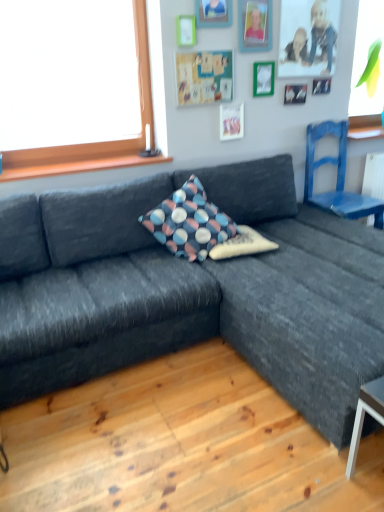
This screenshot has width=384, height=512. What do you see at coordinates (263, 78) in the screenshot? I see `green matte picture frame at upper center, arranged as the 2th picture frame when viewed from the right` at bounding box center [263, 78].

Find the location of a particular element. The image size is (384, 512). textured fabric pillow at center, which appears as the first pillow when ordered from the bottom is located at coordinates (242, 244).

This screenshot has height=512, width=384. What are the coordinates of `metallic silver picture frame at upper center, positioned as the third picture frame in right-to-left order` in the screenshot? It's located at (255, 25).

What is the approximate height of blue painted wood chair at right?

blue painted wood chair at right is 31.37 inches tall.

What do you see at coordinates (193, 292) in the screenshot?
I see `dark gray fabric couch at center` at bounding box center [193, 292].

You are a GUI agent. You are given a task and a screenshot of the screen. Output one action in this format:
    pyautogui.click(x=<x>, y=<y>)
    Task: Click on the wooden picture frame at upper center, which appears as the fifth picture frame when viewed from the right
    The image size is (384, 512).
    Given the screenshot: What is the action you would take?
    pyautogui.click(x=214, y=13)

Identify the location of polka dot fabric pillow at center, placed as the first pillow when sorted from top to bottom. The width and height of the screenshot is (384, 512). (189, 222).

Between wooden picture frame at upper center, which is the sixth picture frame from left to right, and white paper at upper center, which appears as the fourth picture frame when viewed from the right, which one has larger size?

white paper at upper center, which appears as the fourth picture frame when viewed from the right.

Based on the photo, from a real-world perspective, which is physically below, wooden picture frame at upper center, which is the sixth picture frame from left to right, or white paper at upper center, which appears as the fourth picture frame when viewed from the right?

Result: From a 3D spatial view, white paper at upper center, which appears as the fourth picture frame when viewed from the right, is below.

Does wooden picture frame at upper center, which is the sixth picture frame from left to right, have a greater width compared to white paper at upper center, which appears as the fourth picture frame when viewed from the right?

Incorrect, the width of wooden picture frame at upper center, which is the sixth picture frame from left to right, does not surpass that of white paper at upper center, which appears as the fourth picture frame when viewed from the right.

From the image's perspective, relative to white paper at upper center, which is the 3th picture frame from left to right, is wooden picture frame at upper center, positioned as the first picture frame in right-to-left order, above or below?

wooden picture frame at upper center, positioned as the first picture frame in right-to-left order, is situated higher than white paper at upper center, which is the 3th picture frame from left to right, in the image.

Is the surface of polka dot fabric pillow at center, which is counted as the second pillow, starting from the bottom, in direct contact with wooden picture frame at upper center, positioned as the first picture frame in right-to-left order?

No, polka dot fabric pillow at center, which is counted as the second pillow, starting from the bottom, is not beside wooden picture frame at upper center, positioned as the first picture frame in right-to-left order.

Identify the location of pillow that is the 1st object located below the wooden picture frame at upper center, which is the sixth picture frame from left to right (from the image's perspective). Image resolution: width=384 pixels, height=512 pixels. (189, 222).

Is wooden picture frame at upper center, which is the sixth picture frame from left to right, located within polka dot fabric pillow at center, placed as the first pillow when sorted from top to bottom?

No.

Does polka dot fabric pillow at center, placed as the first pillow when sorted from top to bottom, appear on the left side of wooden picture frame at upper center, which is the sixth picture frame from left to right?

Yes.

Is green matte picture frame at upper center, the fifth picture frame in the left-to-right sequence, looking in the opposite direction of metallic silver picture frame at upper center, marked as the fourth picture frame in a left-to-right arrangement?

No, green matte picture frame at upper center, the fifth picture frame in the left-to-right sequence, is not facing the opposite direction of metallic silver picture frame at upper center, marked as the fourth picture frame in a left-to-right arrangement.

Considering the relative positions of green matte picture frame at upper center, the fifth picture frame in the left-to-right sequence, and metallic silver picture frame at upper center, marked as the fourth picture frame in a left-to-right arrangement, in the image provided, is green matte picture frame at upper center, the fifth picture frame in the left-to-right sequence, to the left of metallic silver picture frame at upper center, marked as the fourth picture frame in a left-to-right arrangement, from the viewer's perspective?

In fact, green matte picture frame at upper center, the fifth picture frame in the left-to-right sequence, is to the right of metallic silver picture frame at upper center, marked as the fourth picture frame in a left-to-right arrangement.

Considering the positions of points (267, 82) and (269, 28), is point (267, 82) farther from camera compared to point (269, 28)?

Yes, point (267, 82) is behind point (269, 28).

Is green matte picture frame at upper center, the fifth picture frame in the left-to-right sequence, touching metallic silver picture frame at upper center, marked as the fourth picture frame in a left-to-right arrangement?

No, green matte picture frame at upper center, the fifth picture frame in the left-to-right sequence, is not next to metallic silver picture frame at upper center, marked as the fourth picture frame in a left-to-right arrangement.

From their relative heights in the image, would you say metallic silver picture frame at upper center, marked as the fourth picture frame in a left-to-right arrangement, is taller or shorter than matte green bulletin board at upper center?

Considering their sizes, metallic silver picture frame at upper center, marked as the fourth picture frame in a left-to-right arrangement, has more height than matte green bulletin board at upper center.

Find the location of `bulletin board on the left of metallic silver picture frame at upper center, marked as the fourth picture frame in a left-to-right arrangement`. bulletin board on the left of metallic silver picture frame at upper center, marked as the fourth picture frame in a left-to-right arrangement is located at coordinates (204, 77).

From the image's perspective, which one is positioned lower, metallic silver picture frame at upper center, marked as the fourth picture frame in a left-to-right arrangement, or matte green bulletin board at upper center?

matte green bulletin board at upper center is shown below in the image.

Would you say metallic silver picture frame at upper center, positioned as the third picture frame in right-to-left order, is inside or outside matte green bulletin board at upper center?

metallic silver picture frame at upper center, positioned as the third picture frame in right-to-left order, is located beyond the bounds of matte green bulletin board at upper center.

Which of these two, white paper at upper center, which is the 3th picture frame from left to right, or textured fabric pillow at center, which appears as the first pillow when ordered from the bottom, is thinner?

white paper at upper center, which is the 3th picture frame from left to right, is thinner.

Consider the image. Between white paper at upper center, which appears as the fourth picture frame when viewed from the right, and textured fabric pillow at center, the 2th pillow positioned from the top, which one appears on the right side from the viewer's perspective?

Positioned to the right is white paper at upper center, which appears as the fourth picture frame when viewed from the right.

From the image's perspective, which object appears higher, white paper at upper center, which appears as the fourth picture frame when viewed from the right, or textured fabric pillow at center, which appears as the first pillow when ordered from the bottom?

white paper at upper center, which appears as the fourth picture frame when viewed from the right, is shown above in the image.

In the scene shown: Could you tell me if white paper at upper center, which appears as the fourth picture frame when viewed from the right, is facing textured fabric pillow at center, which appears as the first pillow when ordered from the bottom?

No.

Is matte green bulletin board at upper center at the back of green matte picture frame at upper center, the 6th picture frame positioned from the right?

No, green matte picture frame at upper center, the 6th picture frame positioned from the right, is not facing away from matte green bulletin board at upper center.

Which object is positioned more to the left, green matte picture frame at upper center, the 6th picture frame positioned from the right, or matte green bulletin board at upper center?

Positioned to the left is green matte picture frame at upper center, the 6th picture frame positioned from the right.

Does green matte picture frame at upper center, the 6th picture frame positioned from the right, lie behind matte green bulletin board at upper center?

No, green matte picture frame at upper center, the 6th picture frame positioned from the right, is in front of matte green bulletin board at upper center.

Looking at the image, does green matte picture frame at upper center, the 6th picture frame positioned from the right, seem bigger or smaller compared to matte green bulletin board at upper center?

Considering their sizes, green matte picture frame at upper center, the 6th picture frame positioned from the right, takes up less space than matte green bulletin board at upper center.

From a real-world perspective, which is physically below, green matte picture frame at upper center, the fifth picture frame in the left-to-right sequence, or matte green bulletin board at upper center?

In real-world perspective, green matte picture frame at upper center, the fifth picture frame in the left-to-right sequence, is lower.

What's the angular difference between green matte picture frame at upper center, the fifth picture frame in the left-to-right sequence, and matte green bulletin board at upper center's facing directions?

0.991 degrees separate the facing orientations of green matte picture frame at upper center, the fifth picture frame in the left-to-right sequence, and matte green bulletin board at upper center.

Is green matte picture frame at upper center, the fifth picture frame in the left-to-right sequence, far from matte green bulletin board at upper center?

No.

Is green matte picture frame at upper center, arranged as the 2th picture frame when viewed from the right, thinner than matte green bulletin board at upper center?

Correct, the width of green matte picture frame at upper center, arranged as the 2th picture frame when viewed from the right, is less than that of matte green bulletin board at upper center.

From the white paper at upper center, which appears as the fourth picture frame when viewed from the right, count 2nd picture frames backward and point to it. Please provide its 2D coordinates.

[(295, 94)]

From a real-world perspective, starting from the polka dot fabric pillow at center, which is counted as the second pillow, starting from the bottom, which picture frame is the 2nd one vertically above it? Please provide its 2D coordinates.

[(295, 94)]

Considering their positions, is green matte picture frame at upper center, arranged as the 2th picture frame when viewed from the right, positioned closer to matte green bulletin board at upper center than metallic silver picture frame at upper center, marked as the fourth picture frame in a left-to-right arrangement?

The object closer to matte green bulletin board at upper center is metallic silver picture frame at upper center, marked as the fourth picture frame in a left-to-right arrangement.

Considering their positions, is metallic silver picture frame at upper center, marked as the fourth picture frame in a left-to-right arrangement, positioned further to green matte picture frame at upper center, the fifth picture frame in the left-to-right sequence, than wooden picture frame at upper center, the second picture frame when ordered from left to right?

wooden picture frame at upper center, the second picture frame when ordered from left to right.

Considering their positions, is white paper at upper center, which is the 3th picture frame from left to right, positioned further to green matte picture frame at upper center, which is counted as the 1th picture frame, starting from the left, than green matte picture frame at upper center, the fifth picture frame in the left-to-right sequence?

Based on the image, green matte picture frame at upper center, the fifth picture frame in the left-to-right sequence, appears to be further to green matte picture frame at upper center, which is counted as the 1th picture frame, starting from the left.

Based on the photo, when comparing their distances from blue painted wood chair at right, does metallic silver picture frame at upper center, positioned as the third picture frame in right-to-left order, or polka dot fabric pillow at center, placed as the first pillow when sorted from top to bottom, seem closer?

Among the two, metallic silver picture frame at upper center, positioned as the third picture frame in right-to-left order, is located nearer to blue painted wood chair at right.

From the image, which object appears to be nearer to green matte picture frame at upper center, which is counted as the 1th picture frame, starting from the left, textured fabric pillow at center, the 2th pillow positioned from the top, or green matte picture frame at upper center, the fifth picture frame in the left-to-right sequence?

The object closer to green matte picture frame at upper center, which is counted as the 1th picture frame, starting from the left, is green matte picture frame at upper center, the fifth picture frame in the left-to-right sequence.

Looking at this image, considering their positions, is matte green bulletin board at upper center positioned further to green matte picture frame at upper center, the 6th picture frame positioned from the right, than green matte picture frame at upper center, arranged as the 2th picture frame when viewed from the right?

Among the two, green matte picture frame at upper center, arranged as the 2th picture frame when viewed from the right, is located further to green matte picture frame at upper center, the 6th picture frame positioned from the right.

Looking at the image, which one is located further to blue painted wood chair at right, textured fabric pillow at center, which appears as the first pillow when ordered from the bottom, or wooden picture frame at upper center, positioned as the first picture frame in right-to-left order?

Among the two, textured fabric pillow at center, which appears as the first pillow when ordered from the bottom, is located further to blue painted wood chair at right.

Looking at the image, which one is located closer to green matte picture frame at upper center, which is counted as the 1th picture frame, starting from the left, textured fabric pillow at center, which appears as the first pillow when ordered from the bottom, or wooden picture frame at upper center, the second picture frame when ordered from left to right?

The object closer to green matte picture frame at upper center, which is counted as the 1th picture frame, starting from the left, is wooden picture frame at upper center, the second picture frame when ordered from left to right.

Find the location of a particular element. Image resolution: width=384 pixels, height=512 pixels. bulletin board positioned between dark gray fabric couch at center and metallic silver picture frame at upper center, positioned as the third picture frame in right-to-left order, from near to far is located at coordinates (204, 77).

This screenshot has height=512, width=384. Identify the location of chair between green matte picture frame at upper center, the fifth picture frame in the left-to-right sequence, and textured fabric pillow at center, the 2th pillow positioned from the top, in the vertical direction. (337, 178).

Locate an element on the screen. The height and width of the screenshot is (512, 384). bulletin board between green matte picture frame at upper center, which is counted as the 1th picture frame, starting from the left, and green matte picture frame at upper center, arranged as the 2th picture frame when viewed from the right is located at coordinates (204, 77).

Where is `pillow between wooden picture frame at upper center, the second picture frame when ordered from left to right, and textured fabric pillow at center, which appears as the first pillow when ordered from the bottom, in the vertical direction`? The height and width of the screenshot is (512, 384). pillow between wooden picture frame at upper center, the second picture frame when ordered from left to right, and textured fabric pillow at center, which appears as the first pillow when ordered from the bottom, in the vertical direction is located at coordinates (189, 222).